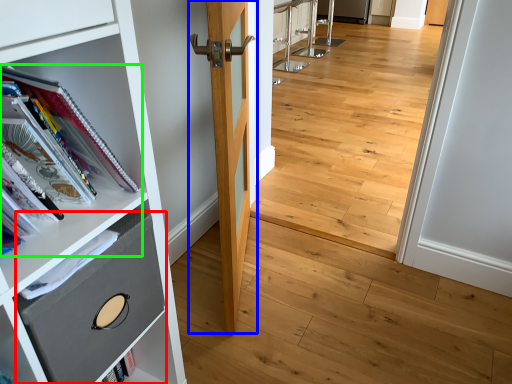
Question: Which is farther away from drawer (highlighted by a red box)? door (highlighted by a blue box) or book (highlighted by a green box)?

Choices:
 (A) door
 (B) book

Answer: (A)